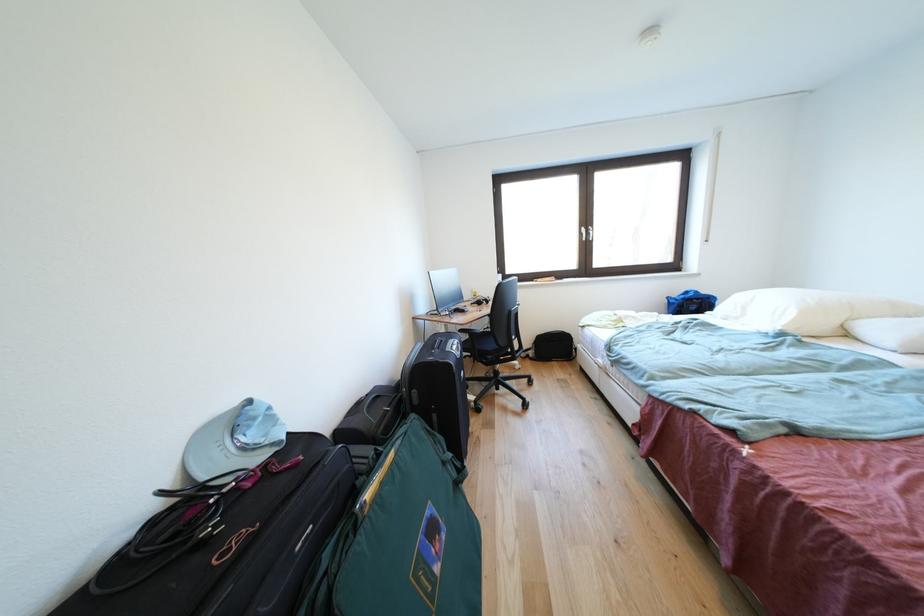
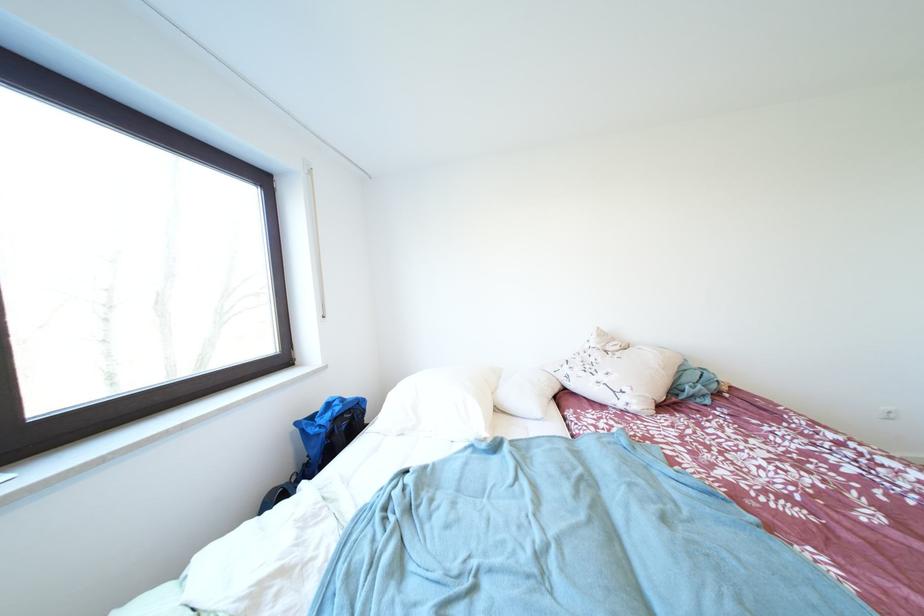
The point at (675, 302) is marked in the first image. Where is the corresponding point in the second image?

(305, 428)